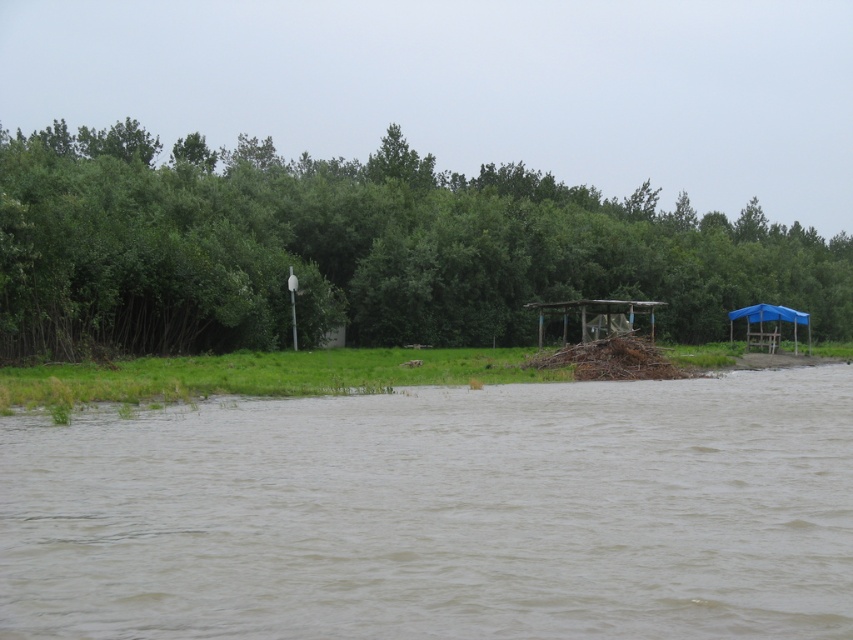
Question: Is brown muddy water at lower center to the right of blue fabric shelter at right from the viewer's perspective?

Choices:
 (A) no
 (B) yes

Answer: (A)

Question: Among these objects, which one is farthest from the camera?

Choices:
 (A) blue fabric shelter at right
 (B) green leafy trees at upper center
 (C) wooden rustic shelter at center

Answer: (A)

Question: Considering the real-world distances, which object is farthest from the blue fabric shelter at right?

Choices:
 (A) brown muddy water at lower center
 (B) wooden rustic shelter at center

Answer: (A)

Question: Can you confirm if wooden rustic shelter at center is smaller than blue fabric shelter at right?

Choices:
 (A) yes
 (B) no

Answer: (A)

Question: Which point is farther to the camera?

Choices:
 (A) (502, 208)
 (B) (635, 337)
 (C) (544, 304)

Answer: (A)

Question: Does green leafy trees at upper center appear on the right side of blue fabric shelter at right?

Choices:
 (A) no
 (B) yes

Answer: (A)